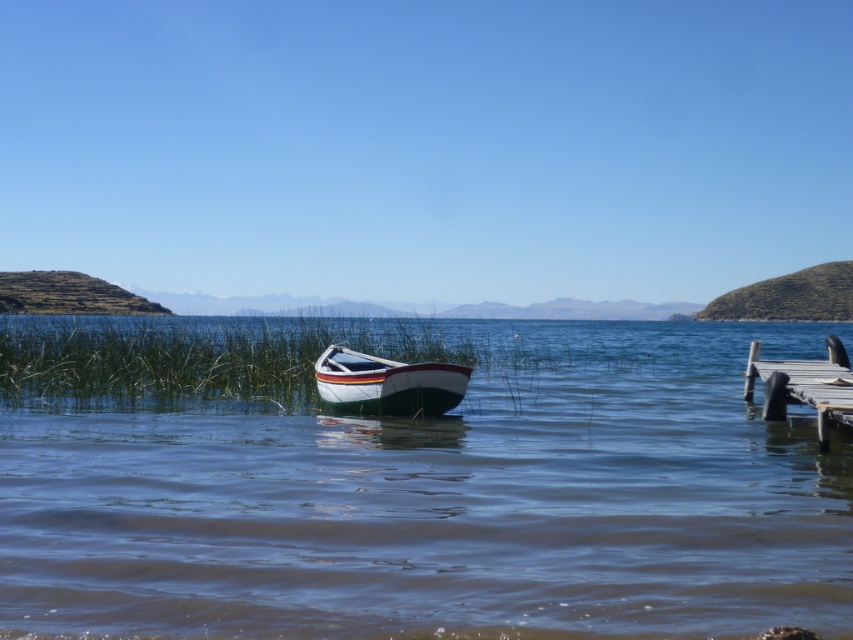
Is clear blue water at center shorter than wooden dock at lower right?

No.

At what (x,y) coordinates should I click in order to perform the action: click on clear blue water at center. Please return your answer as a coordinate pair (x, y). This screenshot has height=640, width=853. Looking at the image, I should click on (412, 483).

Which is in front, point (846, 436) or point (317, 362)?

Positioned in front is point (846, 436).

Does clear blue water at center lie behind white wood boat at center?

No, it is not.

Who is more forward, (169, 440) or (439, 380)?

Positioned in front is point (169, 440).

Where is `clear blue water at center`? clear blue water at center is located at coordinates (412, 483).

Where is `white wood boat at center`? Image resolution: width=853 pixels, height=640 pixels. white wood boat at center is located at coordinates (387, 384).

Is point (339, 385) in front of point (780, 394)?

No.

Where is `white wood boat at center`? Image resolution: width=853 pixels, height=640 pixels. white wood boat at center is located at coordinates (387, 384).